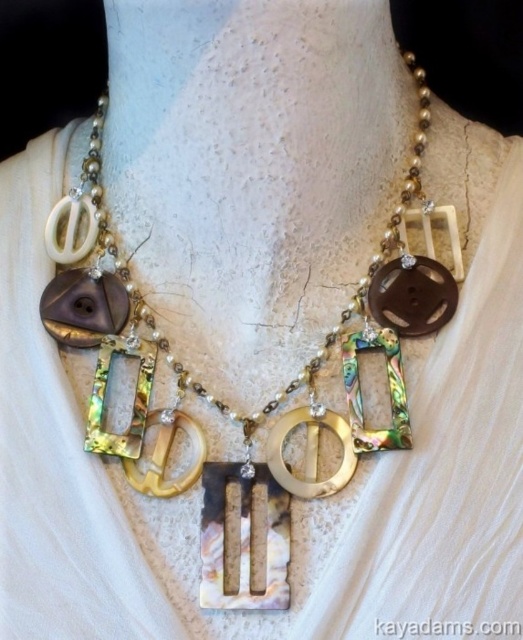
You are a jewelry designer examining the necklace. You need to determine the visibility of the black pearl letter k at center. Is it visible through the shiny abalone shell necklace at center?

The black pearl letter k at center is behind the shiny abalone shell necklace at center, so it is not visible through it.

You are a jewelry designer who wants to ensure the necklace looks balanced. The shiny abalone shell necklace at center and the black pearl letter k at center are both important focal points. Which one should be placed lower to avoid visual imbalance?

The shiny abalone shell necklace at center is much taller than the black pearl letter k at center, so to avoid visual imbalance, the shorter black pearl letter k at center should be placed lower to balance the height difference between the two focal points.